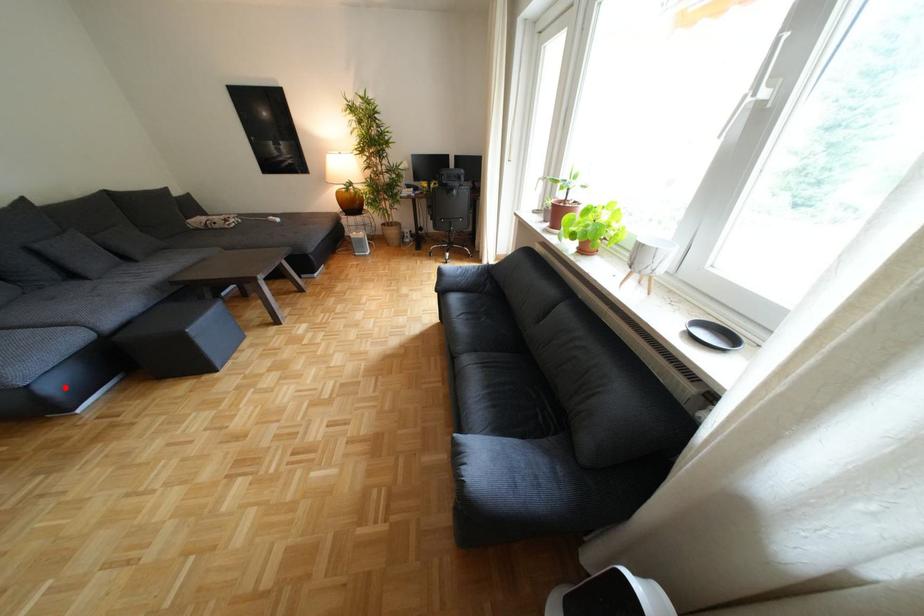
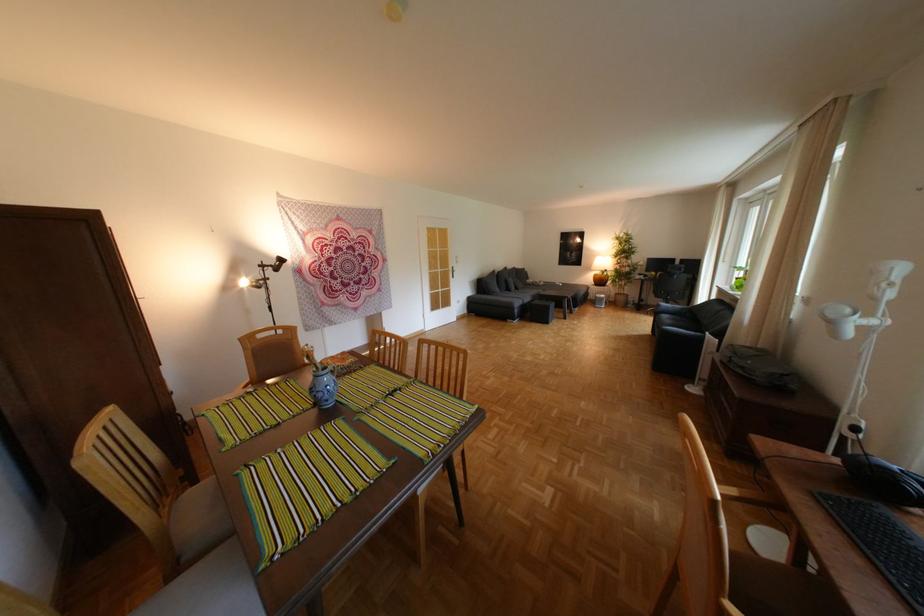
Where in the second image is the point corresponding to the highlighted location from the first image?

(529, 312)